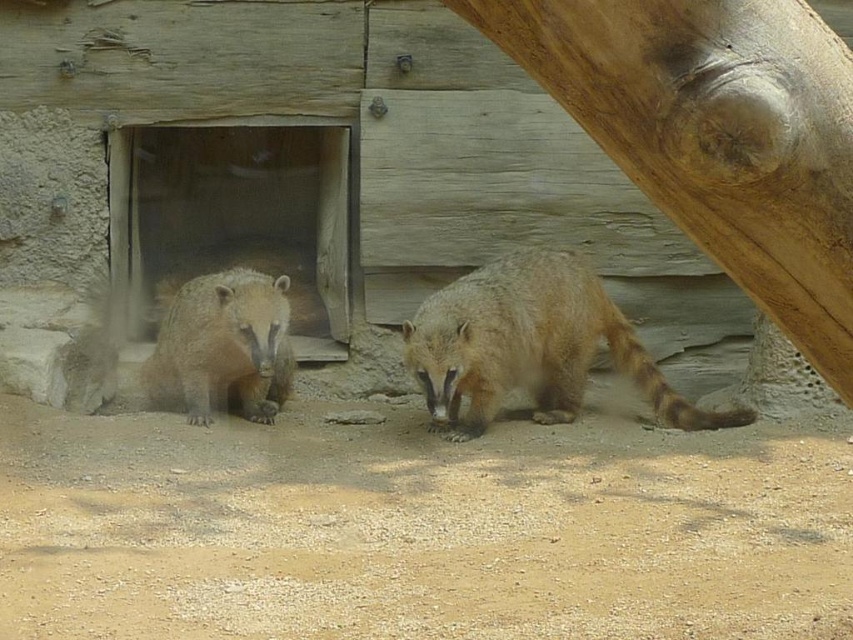
Question: Does smooth brown tree trunk at right have a lesser width compared to fuzzy brown raccoon at center?

Choices:
 (A) yes
 (B) no

Answer: (A)

Question: Among these points, which one is farthest from the camera?

Choices:
 (A) (431, 346)
 (B) (824, 216)

Answer: (A)

Question: Is fuzzy brown raccoon at center wider than fuzzy brown bear at center?

Choices:
 (A) yes
 (B) no

Answer: (A)

Question: Is smooth brown tree trunk at right closer to the viewer compared to fuzzy brown raccoon at center?

Choices:
 (A) yes
 (B) no

Answer: (A)

Question: Which point is closer to the camera?

Choices:
 (A) (273, 378)
 (B) (433, 401)
 (C) (509, 51)

Answer: (C)

Question: Which point is closer to the camera?

Choices:
 (A) (469, 4)
 (B) (236, 397)
 (C) (489, 292)

Answer: (A)